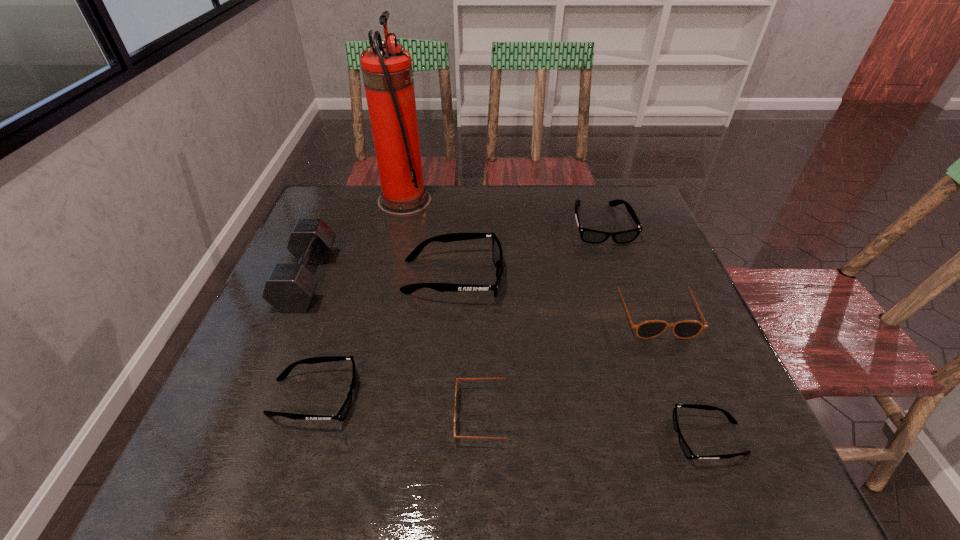
I want to click on the seventh closest object relative to the bigger brown sunglasses, so click(289, 288).

The image size is (960, 540). In order to click on the fourth closest sunglasses to the right brown sunglasses in this screenshot , I will do `click(457, 379)`.

Find the location of a particular element. sunglasses that is the second closest to the right brown sunglasses is located at coordinates tap(689, 454).

Locate an element on the screen. the closest black sunglasses to the tallest object is located at coordinates (497, 253).

Identify which black sunglasses is located as the second nearest to the smallest black sunglasses. Please provide its 2D coordinates. Your answer should be formatted as a tuple, i.e. [(x, y)], where the tuple contains the x and y coordinates of a point satisfying the conditions above.

[(587, 235)]

Find the location of `free space that satisfies the following two spatial constraints: 1. at the discharge end of the tallest object; 2. on the front side of the second tallest object`. free space that satisfies the following two spatial constraints: 1. at the discharge end of the tallest object; 2. on the front side of the second tallest object is located at coordinates (387, 280).